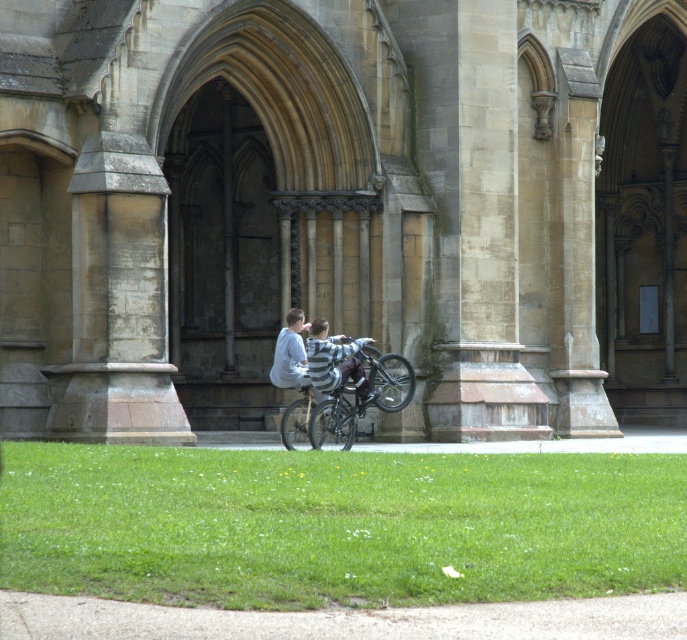
Question: Does stone church at center appear on the left side of green grass at lower center?

Choices:
 (A) no
 (B) yes

Answer: (A)

Question: Which object is farther from the camera taking this photo?

Choices:
 (A) green grass at lower center
 (B) stone church at center

Answer: (B)

Question: From the image, what is the correct spatial relationship of stone church at center in relation to shiny metallic bicycle at center?

Choices:
 (A) below
 (B) above

Answer: (B)

Question: Which object appears farthest from the camera in this image?

Choices:
 (A) green grass at lower center
 (B) stone church at center
 (C) shiny metallic bicycle at center

Answer: (B)

Question: Which point appears farthest from the camera in this image?

Choices:
 (A) (344, 500)
 (B) (315, 208)

Answer: (B)

Question: Can you confirm if stone church at center is wider than shiny metallic bicycle at center?

Choices:
 (A) yes
 (B) no

Answer: (A)